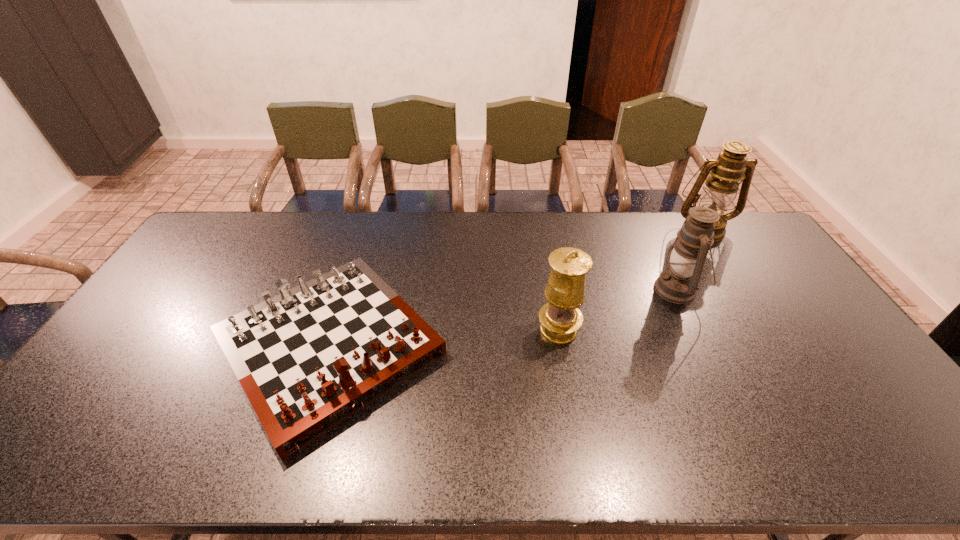
I want to click on free space located on the front of the third object from right to left, so click(572, 409).

Identify the location of free space located 0.080m on the right of the gameboard. click(475, 347).

The height and width of the screenshot is (540, 960). In order to click on object present at the far edge in this screenshot , I will do `click(732, 165)`.

Locate an element on the screen. The height and width of the screenshot is (540, 960). object that is at the near edge is located at coordinates (309, 358).

The image size is (960, 540). Find the location of `object that is positioned at the right edge`. object that is positioned at the right edge is located at coordinates (732, 165).

Where is `object at the far right corner`? object at the far right corner is located at coordinates (732, 165).

Locate an element on the screen. The height and width of the screenshot is (540, 960). vacant area at the far edge of the desktop is located at coordinates (400, 213).

Locate an element on the screen. Image resolution: width=960 pixels, height=540 pixels. vacant region at the near edge of the desktop is located at coordinates (98, 462).

Identify the location of free space at the left edge. This screenshot has height=540, width=960. (203, 278).

The image size is (960, 540). Identify the location of unoccupied position between the rightmost oil lamp and the shortest object. (516, 287).